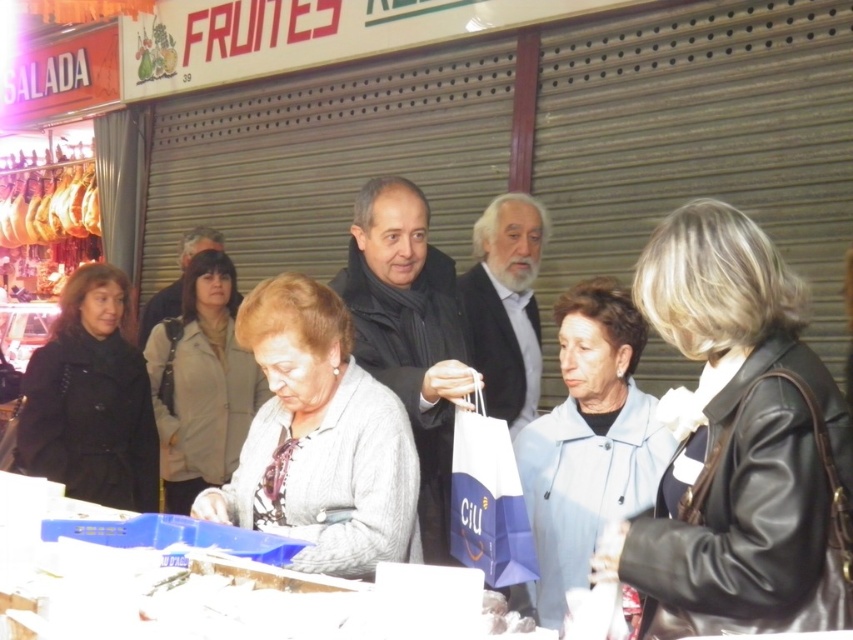
You are standing at the entrance of the market stall and see the white paper shopping bag at center located at point (488,499). If you want to pick it up, which direction should you move relative to your current position?

The white paper shopping bag at center is located at point (488,499), so you should move towards the center of the image to pick it up.

You are standing at the center of the scene. There is a white beard located at point (506, 305). Can you see the white beard from your current position?

Yes, the white beard at center is located at point (506, 305), so you can see it from the center of the scene.